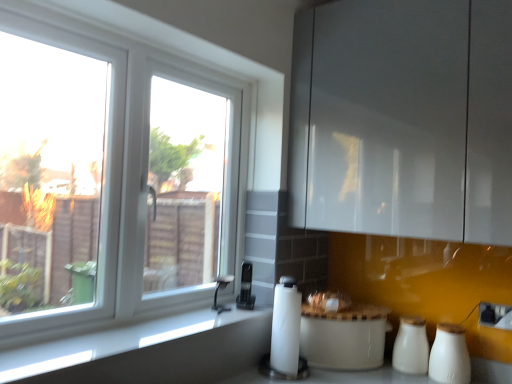
Identify the location of vacant area on top of white plastic window at left (from a real-world perspective). This screenshot has width=512, height=384. (162, 45).